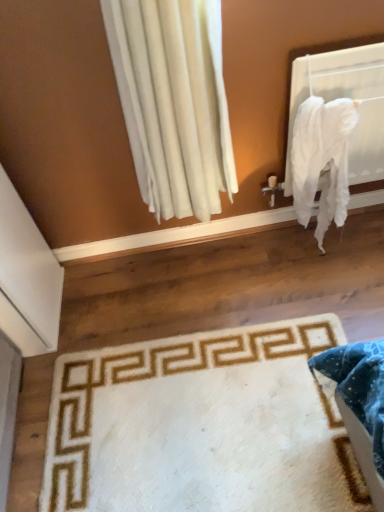
At what (x,y) coordinates should I click in order to perform the action: click on free space below white cotton blanket at right (from a real-world perspective). Please return your answer as a coordinate pair (x, y). The height and width of the screenshot is (512, 384). Looking at the image, I should click on (306, 256).